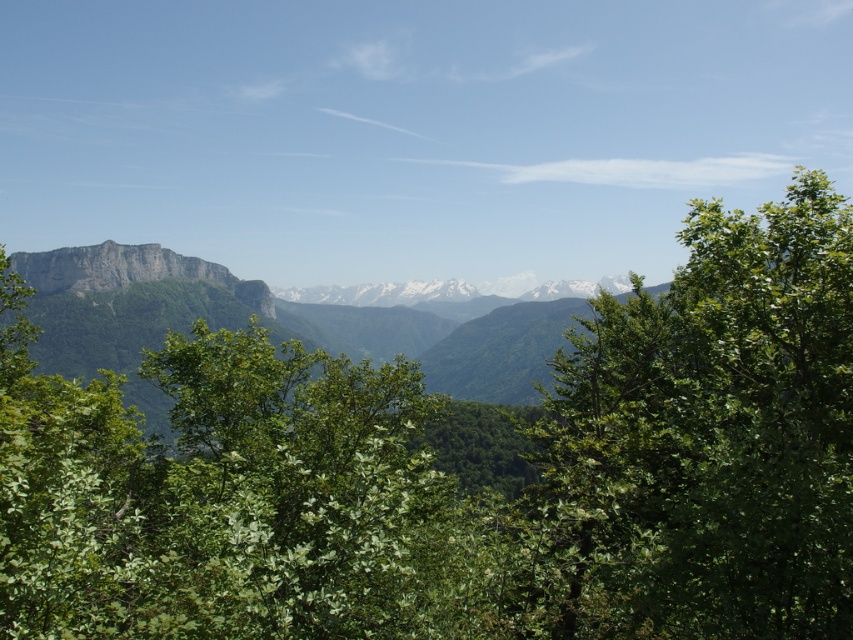
You are hiking and want to take a photo of both the green leafy tree at center and the green leafy tree at right. Which tree should you stand closer to in order to capture both in the frame?

You should stand closer to the green leafy tree at right because it is smaller than the green leafy tree at center, allowing both to fit within the camera frame when positioned appropriately.

Looking at the scene, which green leafy tree is positioned to the left between the green leafy tree at center and the green leafy tree at right?

The green leafy tree at center is positioned to the left of the green leafy tree at right.